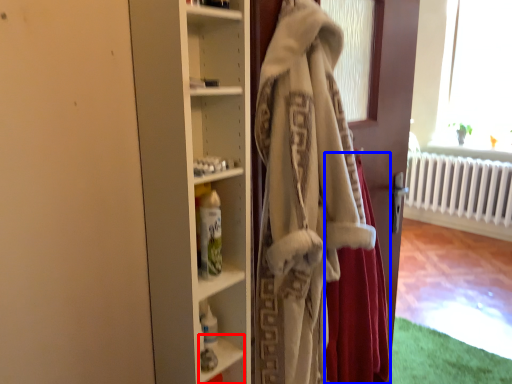
Question: Which point is further to the camera, shelf (highlighted by a red box) or shawl (highlighted by a blue box)?

Choices:
 (A) shelf
 (B) shawl

Answer: (A)